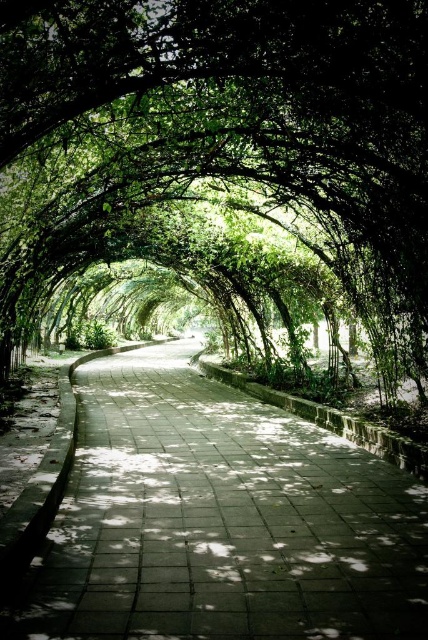
You are standing at the starting point of the pathway and want to reach the end. There are two points marked on the path, point A at coordinates point A is point (366, 193) and point B at coordinates point B is point (149, 586). Which point will you encounter first while walking along the pathway?

Point B at coordinates point B is point (149, 586) will be encountered first because point A at coordinates point A is point (366, 193) is behind it.

You are walking along the pathway and want to know if the green leafy archway at center is blocking the sunlight from reaching the concrete paving at center. Based on the scene, can you determine if the sunlight is blocked or not?

The green leafy archway at center is above the concrete paving at center, so the sunlight filtering through the leaves casts dappled shadows on the concrete paving at center, meaning it is partially blocked but not completely obstructed.

You are standing at the start of the pathway and notice a point marked at coordinates [222,122]. What does this point represent in the scene?

The point at [222,122] represents the green leafy archway at center.